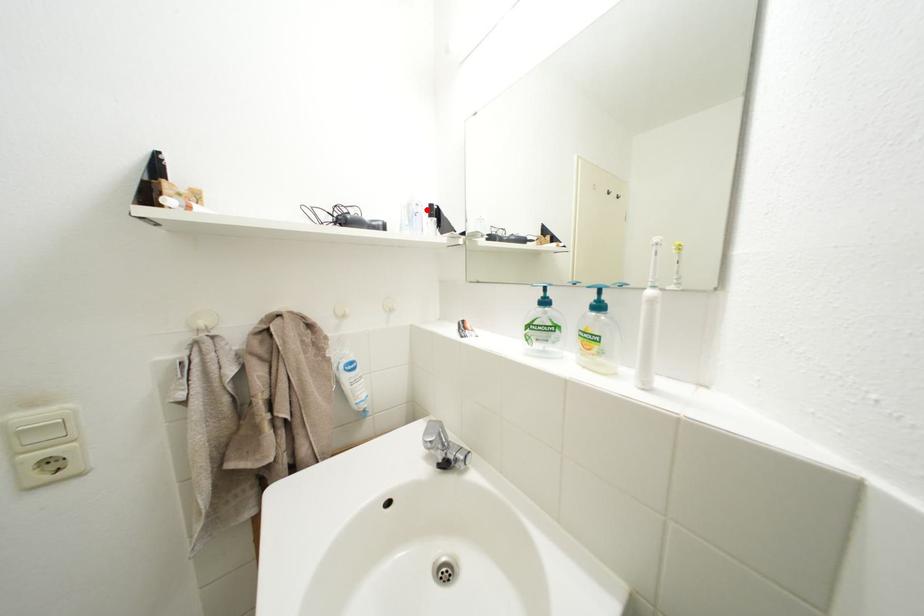
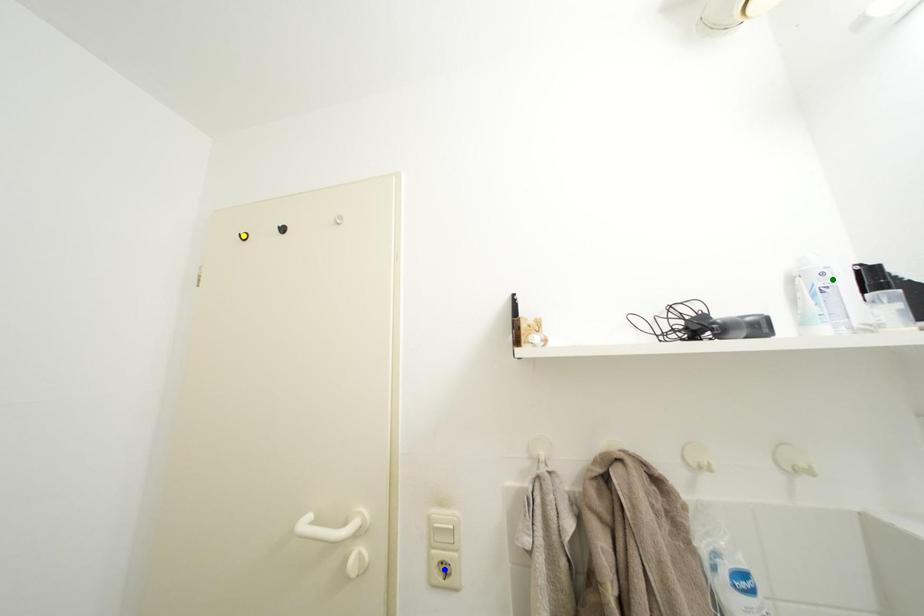
Question: I am providing you with two images of the same scene from different viewpoints. A red point is marked on the first image. You are given multiple points on the second image. In image 2, which mark is for the same physical point as the one in image 1?

Choices:
 (A) yellow point
 (B) blue point
 (C) green point

Answer: (C)